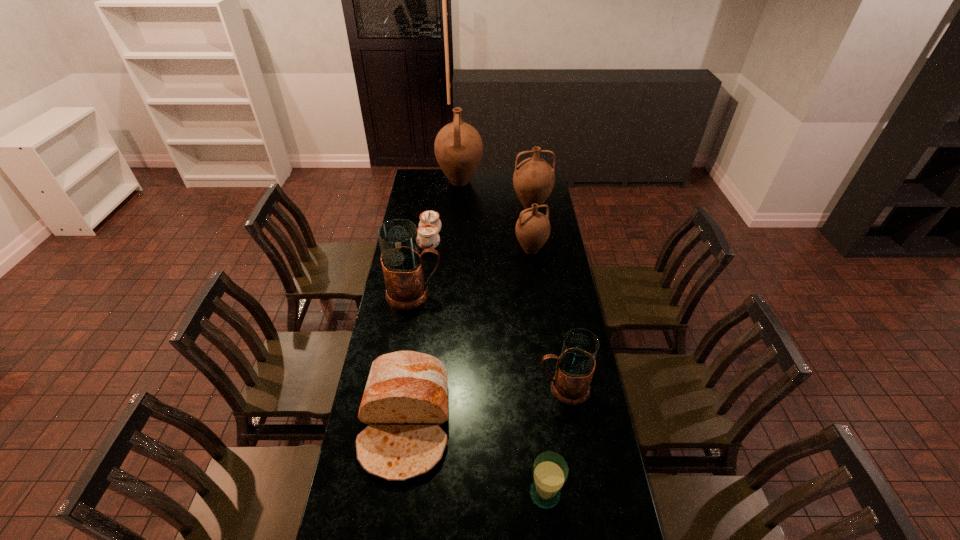
Image resolution: width=960 pixels, height=540 pixels. I want to click on object that ranks as the closest to the bread, so click(550, 471).

The image size is (960, 540). I want to click on pitcher that is the fourth closest to the second nearest brown pitcher, so click(x=574, y=369).

Identify which pitcher is located as the fourth nearest to the blue glass. Please provide its 2D coordinates. Your answer should be formatted as a tuple, i.e. [(x, y)], where the tuple contains the x and y coordinates of a point satisfying the conditions above.

[(533, 179)]

Locate an element on the screen. The width and height of the screenshot is (960, 540). brown pitcher that is the second nearest to the blue glass is located at coordinates (533, 179).

Locate an element on the screen. brown pitcher that is the second closest to the farthest brown pitcher is located at coordinates (532, 229).

Find the location of a particular element. blank space that satisfies the following two spatial constraints: 1. on the front side of the third nearest pitcher; 2. on the right side of the farthest object is located at coordinates coord(455,250).

You are a GUI agent. You are given a task and a screenshot of the screen. Output one action in this format:
    pyautogui.click(x=<x>, y=<y>)
    Task: Click on the vacant space that satisfies the following two spatial constraints: 1. on the back side of the smallest brown pitcher; 2. by the handle of the white chinaware
    This screenshot has height=540, width=960.
    Given the screenshot: What is the action you would take?
    pyautogui.click(x=530, y=241)

You are a GUI agent. You are given a task and a screenshot of the screen. Output one action in this format:
    pyautogui.click(x=<x>, y=<y>)
    Task: Click on the free space that satisfies the following two spatial constraints: 1. on the front side of the tallest object; 2. with the handle on the side of the bigger gray pitcher
    
    Given the screenshot: What is the action you would take?
    pos(453,294)

You are a GUI agent. You are given a task and a screenshot of the screen. Output one action in this format:
    pyautogui.click(x=<x>, y=<y>)
    Task: Click on the free space that satisfies the following two spatial constraints: 1. on the back side of the second farthest object; 2. on the left side of the glass
    The width and height of the screenshot is (960, 540).
    Given the screenshot: What is the action you would take?
    pyautogui.click(x=516, y=207)